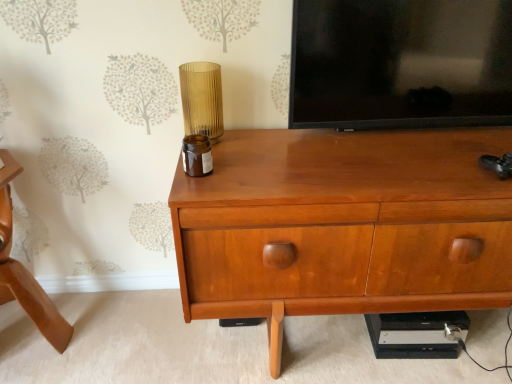
I want to click on free space in front of translucent amber glass at center, so click(x=222, y=169).